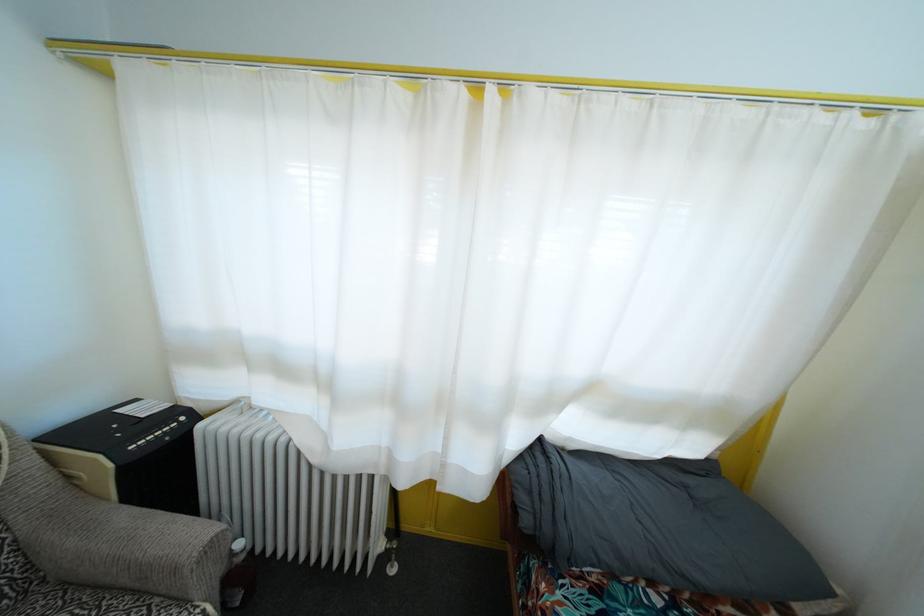
Locate an element on the screen. Image resolution: width=924 pixels, height=616 pixels. grey chair armrest is located at coordinates (82, 590).